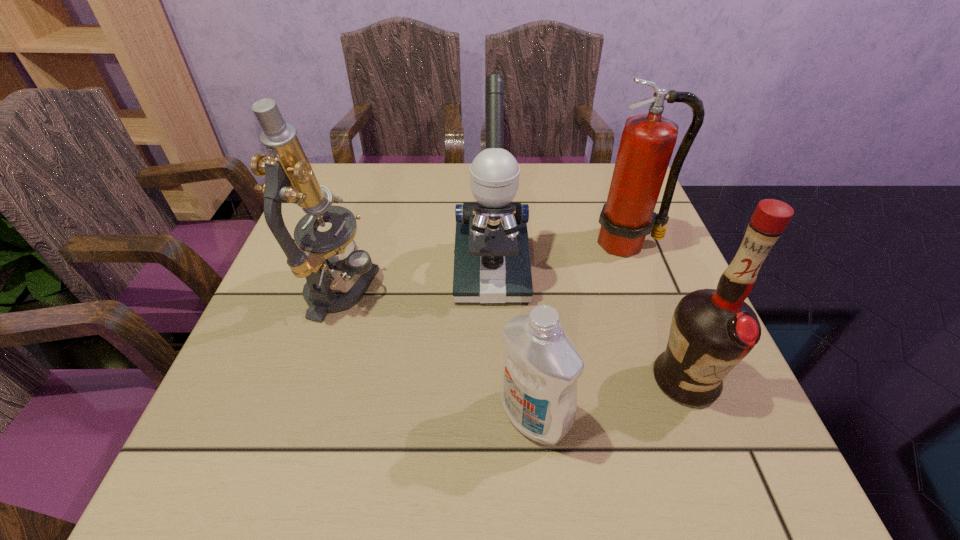
The width and height of the screenshot is (960, 540). What are the coordinates of `free space between the liquor and the right microscope` in the screenshot? It's located at (588, 325).

Locate an element on the screen. Image resolution: width=960 pixels, height=540 pixels. vacant point located between the leftmost object and the shortest object is located at coordinates (438, 354).

The width and height of the screenshot is (960, 540). Identify the location of vacant point located between the liquor and the detergent. (609, 398).

The image size is (960, 540). I want to click on free space between the liquor and the fire extinguisher, so click(x=656, y=312).

Find the location of a particular element. This screenshot has height=540, width=960. empty space between the fire extinguisher and the detergent is located at coordinates (581, 330).

Find the location of a particular element. This screenshot has height=540, width=960. vacant area that lies between the fire extinguisher and the shortest object is located at coordinates (581, 330).

You are a GUI agent. You are given a task and a screenshot of the screen. Output one action in this format:
    pyautogui.click(x=<x>, y=<y>)
    Task: Click on the empty location between the fire extinguisher and the liquor
    
    Given the screenshot: What is the action you would take?
    pyautogui.click(x=656, y=312)

Find the location of `object that can be found as the second closest to the right microscope`. object that can be found as the second closest to the right microscope is located at coordinates (648, 140).

Find the location of a particular element. Image resolution: width=960 pixels, height=540 pixels. the third closest object to the liquor is located at coordinates (648, 140).

Find the location of a particular element. vacant space that satisfies the following two spatial constraints: 1. on the front side of the shortest object; 2. on the right side of the leftmost object is located at coordinates click(x=302, y=416).